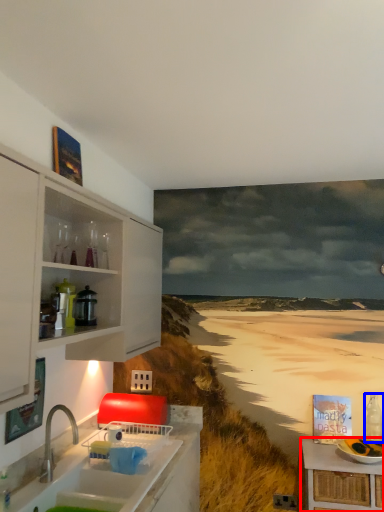
Question: Which object appears closest to the camera in this image, table (highlighted by a red box) or bottle (highlighted by a blue box)?

Choices:
 (A) table
 (B) bottle

Answer: (A)